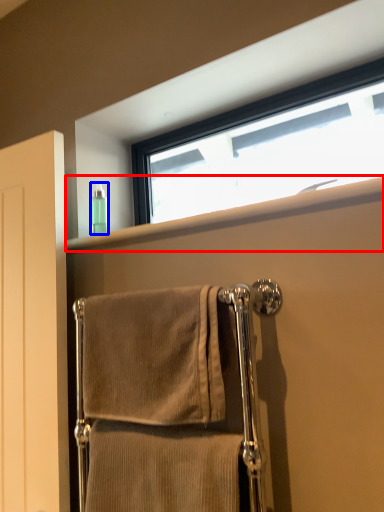
Question: Among these objects, which one is nearest to the camera, window sill (highlighted by a red box) or toiletry (highlighted by a blue box)?

Choices:
 (A) window sill
 (B) toiletry

Answer: (A)